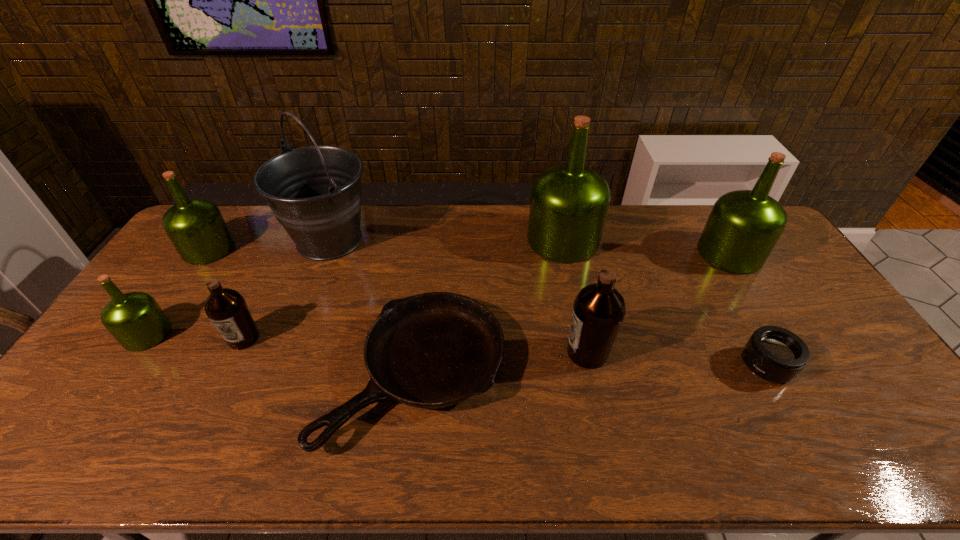
Identify which object is the fourth closest to the smaller brown olive oil. Please provide its 2D coordinates. Your answer should be formatted as a tuple, i.e. [(x, y)], where the tuple contains the x and y coordinates of a point satisfying the conditions above.

[(196, 227)]

This screenshot has height=540, width=960. Identify the location of object that is the fourth closest one to the biggest green olive oil. (775, 354).

At what (x,y) coordinates should I click in order to perform the action: click on olive oil that is the second closest to the third biggest green olive oil. Please return your answer as a coordinate pair (x, y). Image resolution: width=960 pixels, height=540 pixels. Looking at the image, I should click on (226, 308).

Identify which olive oil is the sixth closest to the frying pan. Please provide its 2D coordinates. Your answer should be formatted as a tuple, i.e. [(x, y)], where the tuple contains the x and y coordinates of a point satisfying the conditions above.

[(743, 227)]

Select which green olive oil appears as the closest to the right brown olive oil. Please provide its 2D coordinates. Your answer should be formatted as a tuple, i.e. [(x, y)], where the tuple contains the x and y coordinates of a point satisfying the conditions above.

[(569, 203)]

This screenshot has width=960, height=540. I want to click on green olive oil that is the second nearest to the smallest green olive oil, so click(x=569, y=203).

At what (x,y) coordinates should I click in order to perform the action: click on free spot that satisfies the following two spatial constraints: 1. on the front side of the second tallest olive oil; 2. on the label of the right brown olive oil. Please return your answer as a coordinate pair (x, y). This screenshot has width=960, height=540. Looking at the image, I should click on (791, 353).

In order to click on free location that satisfies the following two spatial constraints: 1. on the back side of the smallest green olive oil; 2. on the left side of the bucket in this screenshot , I will do `click(212, 240)`.